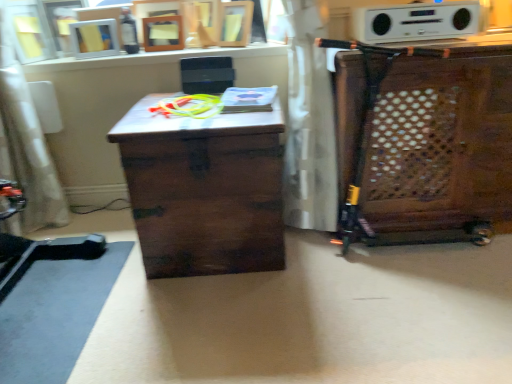
Where is `free space in front of wooden cabinet at right`? free space in front of wooden cabinet at right is located at coordinates (422, 304).